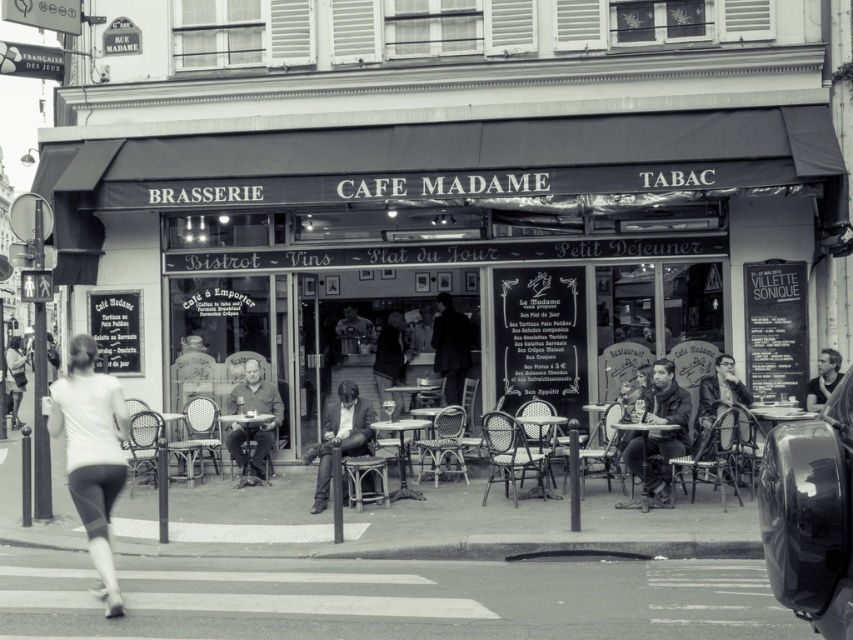
This screenshot has width=853, height=640. Describe the element at coordinates (718, 394) in the screenshot. I see `matte black jacket at right` at that location.

Can you confirm if matte black jacket at right is positioned to the left of matte black jacket at lower left?

In fact, matte black jacket at right is to the right of matte black jacket at lower left.

Between point (701, 417) and point (16, 342), which one is positioned in front?

Point (701, 417)

The width and height of the screenshot is (853, 640). Find the location of `matte black jacket at right`. matte black jacket at right is located at coordinates (718, 394).

Is matte black awning at upper center bigger than smooth leather jacket at center?

Yes, matte black awning at upper center is bigger than smooth leather jacket at center.

This screenshot has height=640, width=853. Describe the element at coordinates (451, 227) in the screenshot. I see `matte black awning at upper center` at that location.

The width and height of the screenshot is (853, 640). Identify the location of matte black awning at upper center. (451, 227).

Where is `matte black awning at upper center`? matte black awning at upper center is located at coordinates (451, 227).

Can you confirm if matte black awning at upper center is positioned below smooth skin face at right?

Actually, matte black awning at upper center is above smooth skin face at right.

This screenshot has width=853, height=640. What are the coordinates of `matte black awning at upper center` in the screenshot? It's located at 451,227.